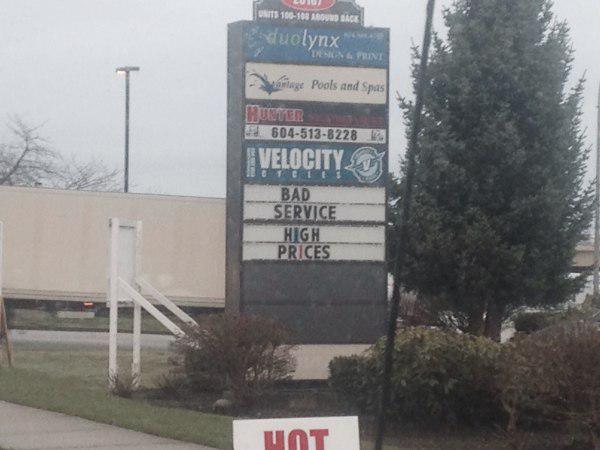
The width and height of the screenshot is (600, 450). In order to click on beige wall in this screenshot , I will do click(33, 256).